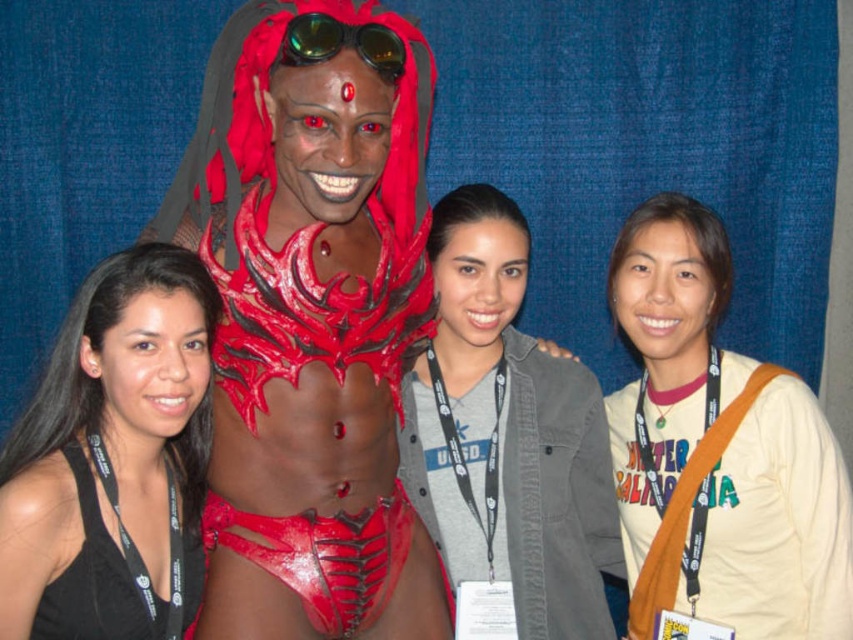
You are standing 5 feet away from the central figure in the image. Is the point at coordinate point (445, 472) closer to you than the central figure?

The distance of point (445, 472) from viewer is 6.33 feet, so the point is farther away than the central figure since you are 5 feet away from the central figure.

Based on the scene description, where is the gray cotton shirt at center located in terms of coordinates?

The gray cotton shirt at center is located at coordinates point (508, 433).